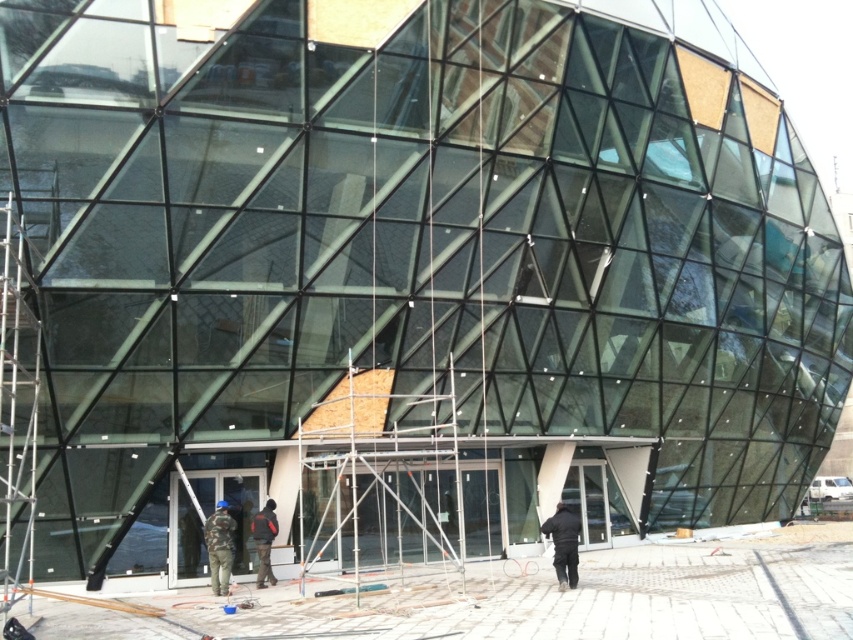
Question: Which point is farther to the camera?

Choices:
 (A) black matte jacket at lower center
 (B) camouflage fabric jacket at lower center

Answer: (B)

Question: Which point appears farthest from the camera in this image?

Choices:
 (A) (263, 531)
 (B) (560, 531)
 (C) (221, 524)

Answer: (A)

Question: Does black matte jacket at lower center lie in front of camouflage fabric jacket at lower center?

Choices:
 (A) yes
 (B) no

Answer: (A)

Question: Does camouflage fabric jacket at lower center appear under dark blue jacket at center?

Choices:
 (A) yes
 (B) no

Answer: (B)

Question: Does black matte jacket at lower center have a larger size compared to camouflage fabric jacket at lower center?

Choices:
 (A) no
 (B) yes

Answer: (A)

Question: Which is nearer to the black matte jacket at lower center?

Choices:
 (A) dark blue jacket at center
 (B) camouflage fabric jacket at lower center

Answer: (A)